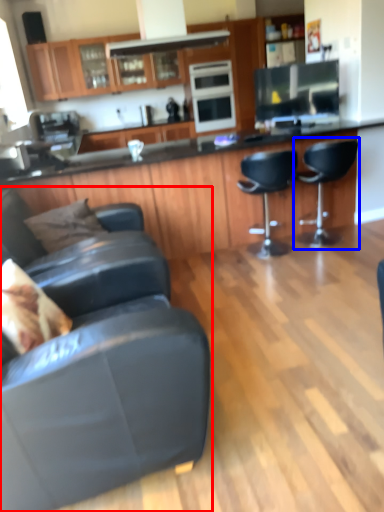
Question: Among these objects, which one is nearest to the camera, chair (highlighted by a red box) or chair (highlighted by a blue box)?

Choices:
 (A) chair
 (B) chair

Answer: (A)